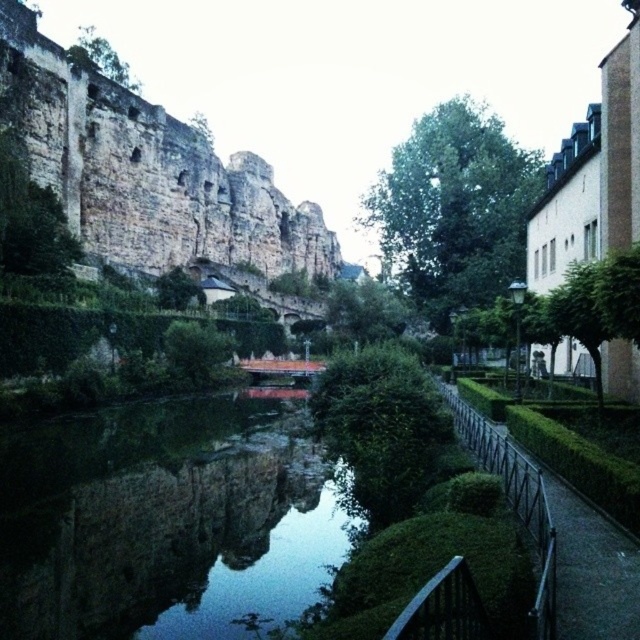
You are standing at the edge of the canal and want to locate the dark reflective water at center. According to the coordinates provided, in which direction should you look relative to your position?

The dark reflective water at center is located at coordinates point (163, 522), so you should look towards the center of the image to find it.